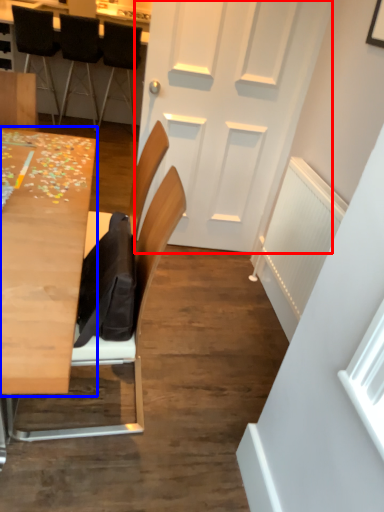
Question: Which point is further to the camera, door (highlighted by a red box) or table (highlighted by a blue box)?

Choices:
 (A) door
 (B) table

Answer: (A)